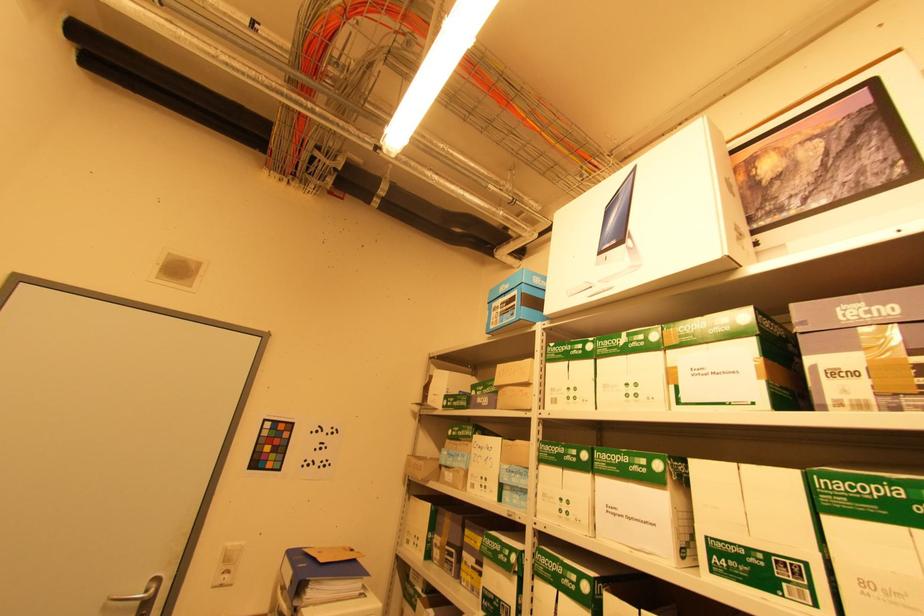
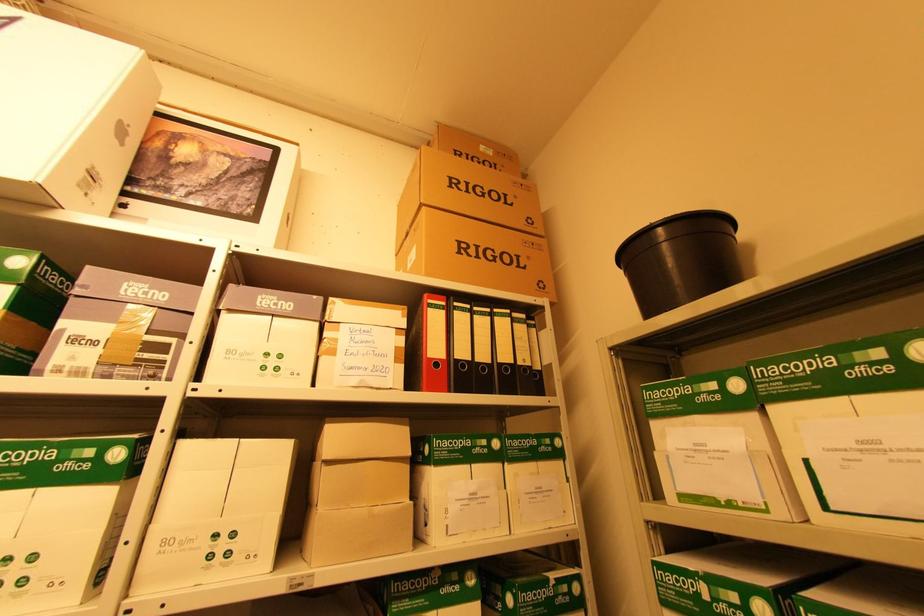
Question: The first image is from the beginning of the video and the second image is from the end. How did the camera likely rotate when shooting the video?

Choices:
 (A) Left
 (B) Right
 (C) Up
 (D) Down

Answer: (B)